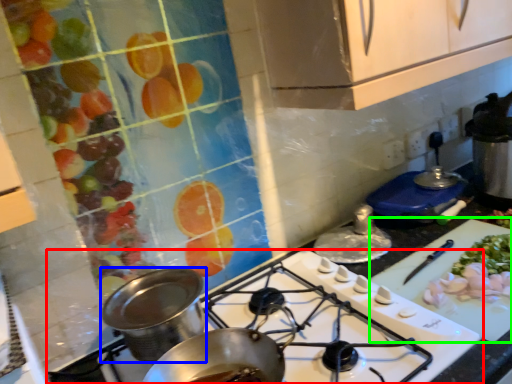
Question: Which object is the closest to the gas stove (highlighted by a red box)? Choose among these: kitchen appliance (highlighted by a blue box) or cutting board (highlighted by a green box).

Choices:
 (A) kitchen appliance
 (B) cutting board

Answer: (B)